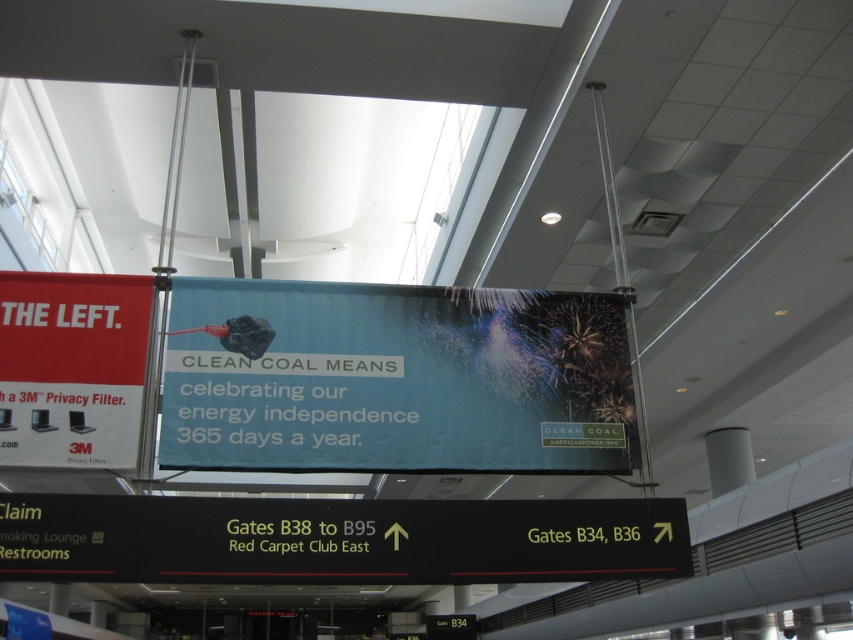
Question: Which of these objects is positioned farthest from the blue fabric billboard at center?

Choices:
 (A) black matte sign at lower center
 (B) matte red banner at left

Answer: (B)

Question: Which object is the farthest from the blue fabric billboard at center?

Choices:
 (A) matte red banner at left
 (B) black matte sign at lower center

Answer: (A)

Question: Is blue fabric billboard at center to the left of matte red banner at left from the viewer's perspective?

Choices:
 (A) yes
 (B) no

Answer: (B)

Question: Estimate the real-world distances between objects in this image. Which object is farther from the black matte sign at lower center?

Choices:
 (A) matte red banner at left
 (B) blue fabric billboard at center

Answer: (A)

Question: Can you confirm if blue fabric billboard at center is bigger than black matte sign at lower center?

Choices:
 (A) yes
 (B) no

Answer: (A)

Question: In this image, where is blue fabric billboard at center located relative to black matte sign at lower center?

Choices:
 (A) left
 (B) right

Answer: (B)